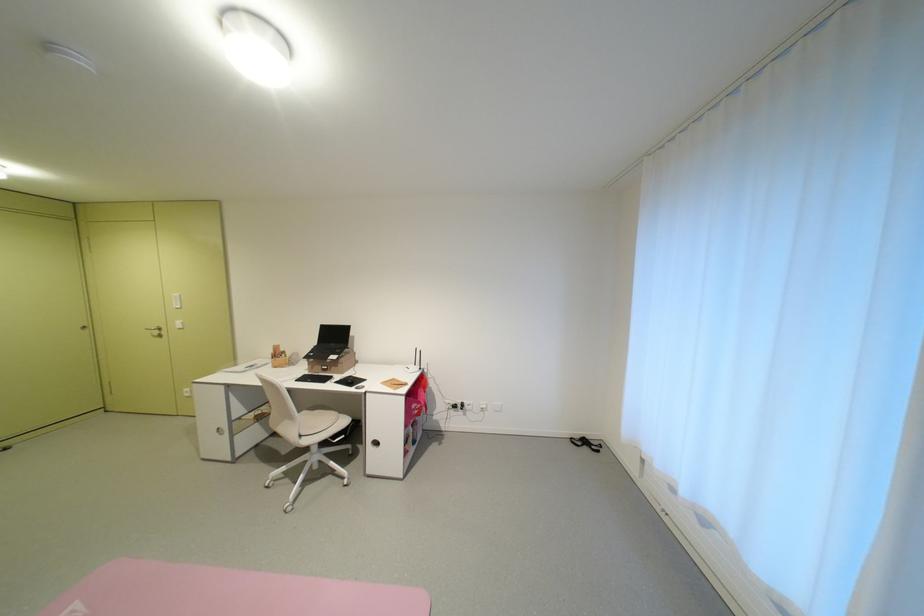
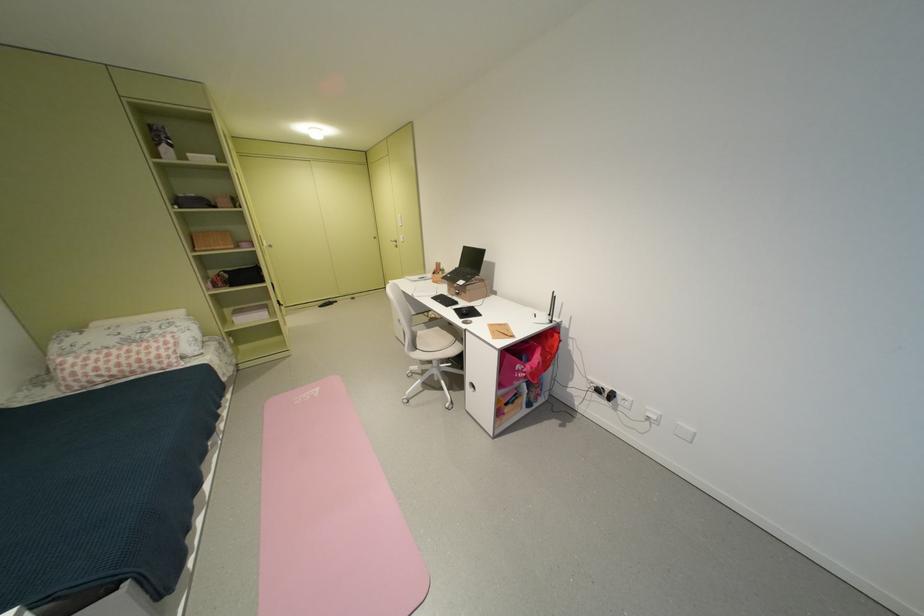
In the second image, find the point that corresponds to pixel 94 329 in the first image.

(383, 238)